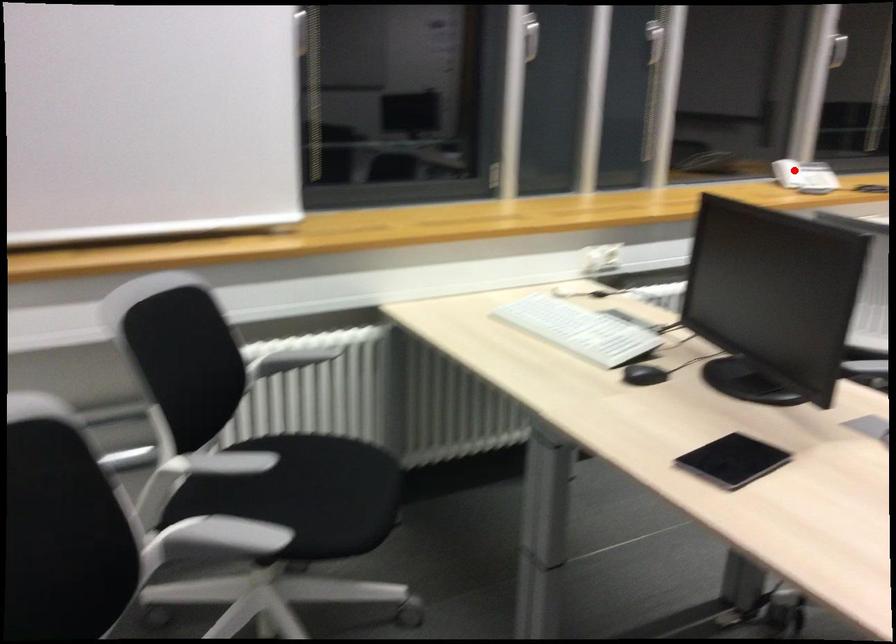
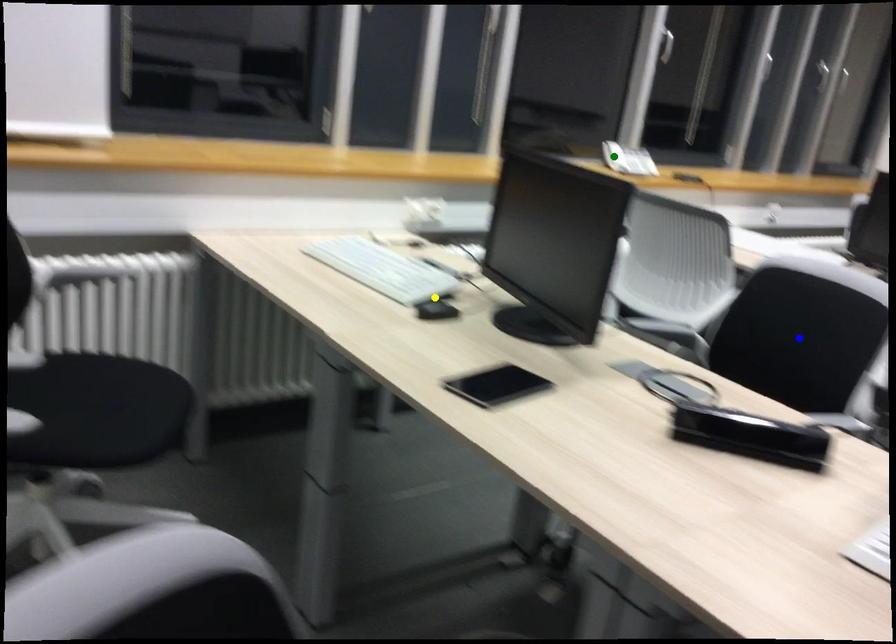
Question: I am providing you with two images of the same scene from different viewpoints. A red point is marked on the first image. You are given multiple points on the second image. Which point in image 2 represents the same 3d spot as the red point in image 1?

Choices:
 (A) yellow point
 (B) green point
 (C) blue point

Answer: (B)